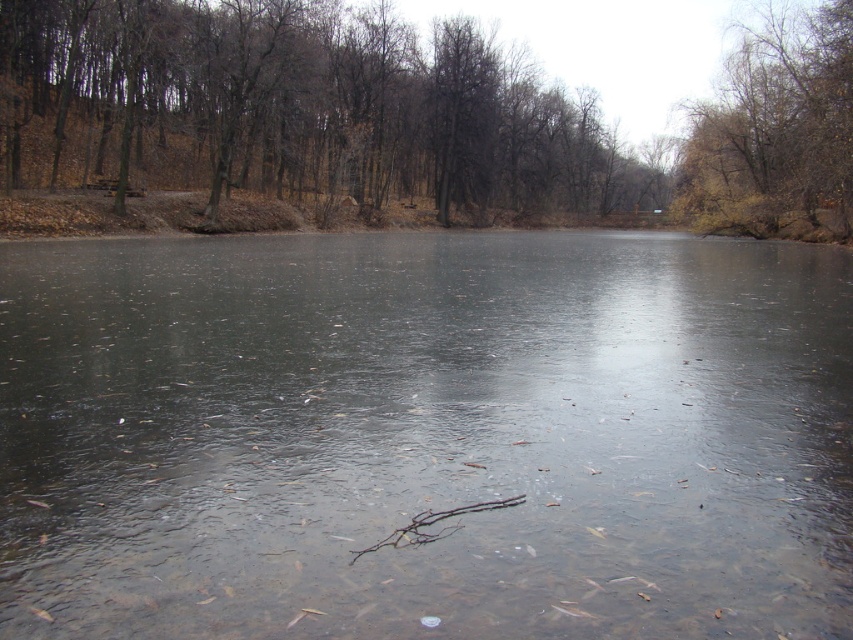
Does transparent ice at center appear under brown/dry wood at left?

Yes, transparent ice at center is below brown/dry wood at left.

Based on the photo, which of these two, transparent ice at center or brown/dry wood at left, stands shorter?

With less height is transparent ice at center.

The height and width of the screenshot is (640, 853). What do you see at coordinates (425, 436) in the screenshot?
I see `transparent ice at center` at bounding box center [425, 436].

At what (x,y) coordinates should I click in order to perform the action: click on transparent ice at center. Please return your answer as a coordinate pair (x, y). Image resolution: width=853 pixels, height=640 pixels. Looking at the image, I should click on (425, 436).

Is brown/dry wood at left wider than brown/dry wood branch at center?

Yes, brown/dry wood at left is wider than brown/dry wood branch at center.

Is brown/dry wood at left thinner than brown/dry wood branch at center?

In fact, brown/dry wood at left might be wider than brown/dry wood branch at center.

Between point (340, 86) and point (453, 508), which one is positioned in front?

Point (453, 508)

Locate an element on the screen. The image size is (853, 640). brown/dry wood at left is located at coordinates (300, 108).

From the picture: Can you confirm if transparent ice at center is positioned above brown/dry wood branch at center?

Correct, transparent ice at center is located above brown/dry wood branch at center.

Between point (379, 618) and point (437, 531), which one is positioned in front?

Positioned in front is point (379, 618).

At what (x,y) coordinates should I click in order to perform the action: click on transparent ice at center. Please return your answer as a coordinate pair (x, y). Looking at the image, I should click on (425, 436).